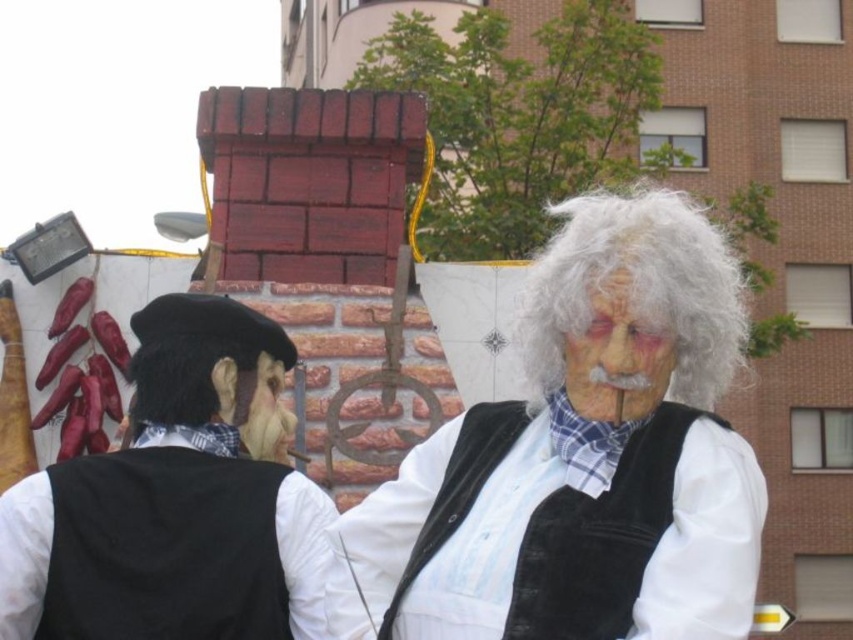
What do you see at coordinates (579, 458) in the screenshot? The image size is (853, 640). I see `white matte vest at center` at bounding box center [579, 458].

Who is more distant from viewer, (428, 497) or (670, 374)?

Positioned behind is point (670, 374).

Find the location of `white matte vest at center`. white matte vest at center is located at coordinates (579, 458).

In the scene shown: Does white curly wig at center lie in front of white matte face at center?

No, white curly wig at center is further to the viewer.

Can you confirm if white curly wig at center is bigger than white matte face at center?

Correct, white curly wig at center is larger in size than white matte face at center.

Is point (578, 218) positioned behind point (639, 321)?

Yes, it is.

Where is `white curly wig at center`? white curly wig at center is located at coordinates (637, 289).

In the scene shown: Is black velvet beret at left positioned before white curly wig at center?

Yes, black velvet beret at left is in front of white curly wig at center.

Can you confirm if black velvet beret at left is wider than white curly wig at center?

Incorrect, black velvet beret at left's width does not surpass white curly wig at center's.

Which is behind, point (173, 570) or point (624, 225)?

The point (624, 225) is more distant.

This screenshot has height=640, width=853. What are the coordinates of `black velvet beret at left` in the screenshot? It's located at (177, 499).